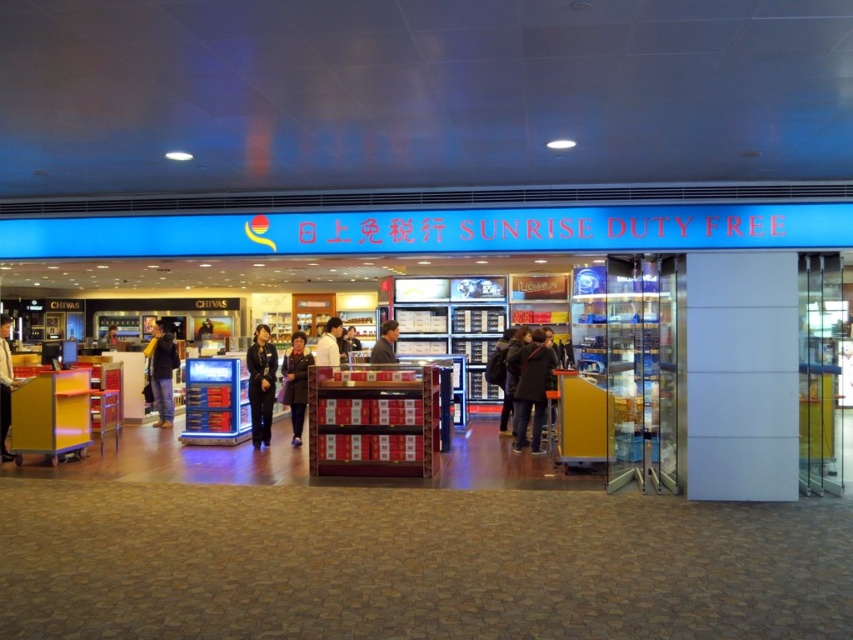
Is point (523, 353) farther from viewer compared to point (323, 346)?

Yes, point (523, 353) is behind point (323, 346).

Describe the element at coordinates (531, 388) in the screenshot. I see `dark gray coat at center` at that location.

In order to click on dark gray coat at center in this screenshot , I will do `click(531, 388)`.

Is point (535, 340) farther from camera compared to point (258, 426)?

No, (535, 340) is closer to viewer.

Does dark gray coat at center have a smaller size compared to dark blue uniform at center?

No, dark gray coat at center is not smaller than dark blue uniform at center.

What are the coordinates of `dark gray coat at center` in the screenshot? It's located at click(x=531, y=388).

Is dark gray jacket at center smaller than white shirt at center?

Yes, dark gray jacket at center is smaller than white shirt at center.

Find the location of a particular element. This screenshot has height=640, width=853. dark gray jacket at center is located at coordinates (514, 374).

In order to click on dark gray jacket at center in this screenshot , I will do `click(514, 374)`.